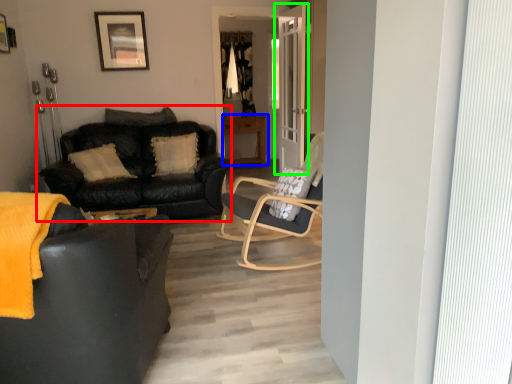
Question: Which object is the closest to the studio couch (highlighted by a red box)? Choose among these: table (highlighted by a blue box) or door (highlighted by a green box).

Choices:
 (A) table
 (B) door

Answer: (B)